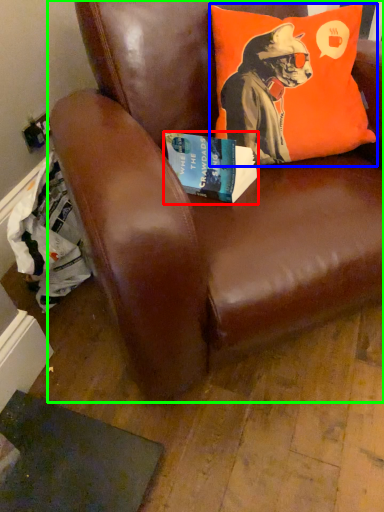
Question: Considering the real-world distances, which object is farthest from book (highlighted by a red box)? pillow (highlighted by a blue box) or chair (highlighted by a green box)?

Choices:
 (A) pillow
 (B) chair

Answer: (B)